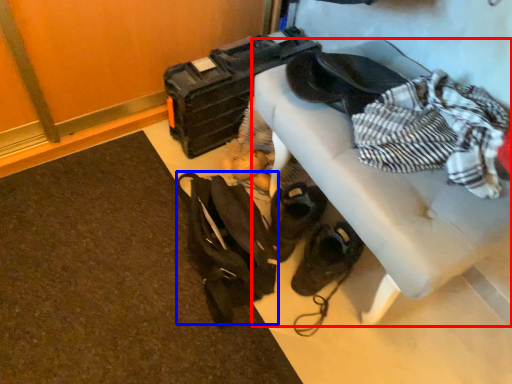
Question: Which object appears farthest to the camera in this image, furniture (highlighted by a red box) or messenger bag (highlighted by a blue box)?

Choices:
 (A) furniture
 (B) messenger bag

Answer: (B)